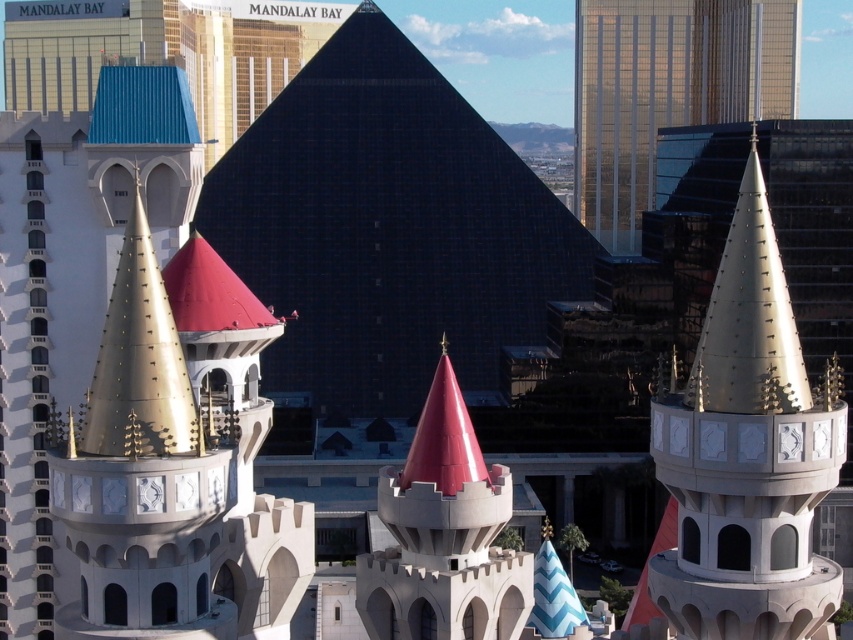
Is black glass pyramid at center above gold metallic spire at center-right?

Incorrect, black glass pyramid at center is not positioned above gold metallic spire at center-right.

Is point (460, 282) farther from camera compared to point (712, 408)?

Yes, point (460, 282) is behind point (712, 408).

Does point (252, 196) lie behind point (735, 336)?

That is True.

The width and height of the screenshot is (853, 640). I want to click on black glass pyramid at center, so click(387, 228).

Is gold metallic spire at center behind gold reflective spire at center?

No, gold metallic spire at center is in front of gold reflective spire at center.

Which of these two, gold metallic spire at center or gold reflective spire at center, stands taller?

Standing taller between the two is gold reflective spire at center.

Which is in front, point (715, 492) or point (779, 28)?

Point (715, 492)

In order to click on gold metallic spire at center in this screenshot , I will do `click(746, 452)`.

Is gold metallic spire at center shorter than gold metallic spire at left?

Incorrect, gold metallic spire at center's height does not fall short of gold metallic spire at left's.

Is gold metallic spire at center thinner than gold metallic spire at left?

Yes.

Locate an element on the screen. The height and width of the screenshot is (640, 853). gold metallic spire at center is located at coordinates (746, 452).

Find the location of a particular element. gold metallic spire at center is located at coordinates (746, 452).